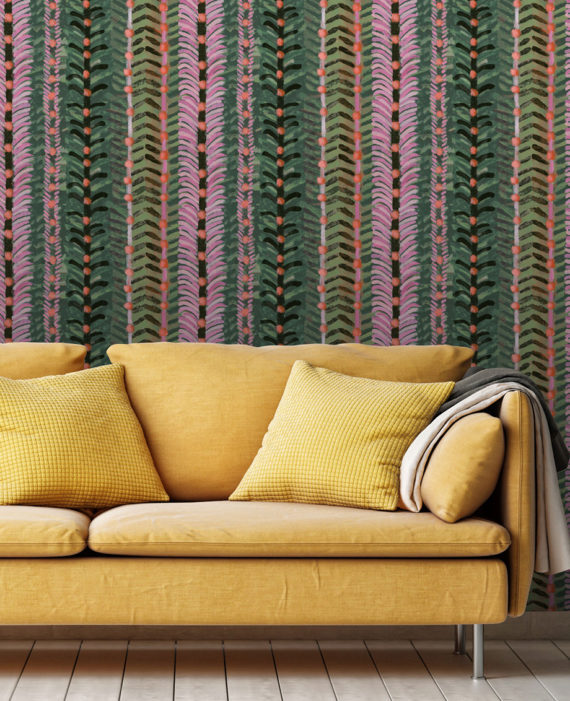
The image size is (570, 701). Identify the location of left arm rest. (523, 458).